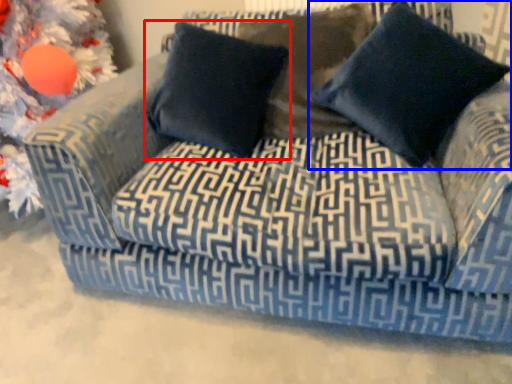
Question: Which of the following is the closest to the observer, pillow (highlighted by a red box) or pillow (highlighted by a blue box)?

Choices:
 (A) pillow
 (B) pillow

Answer: (B)